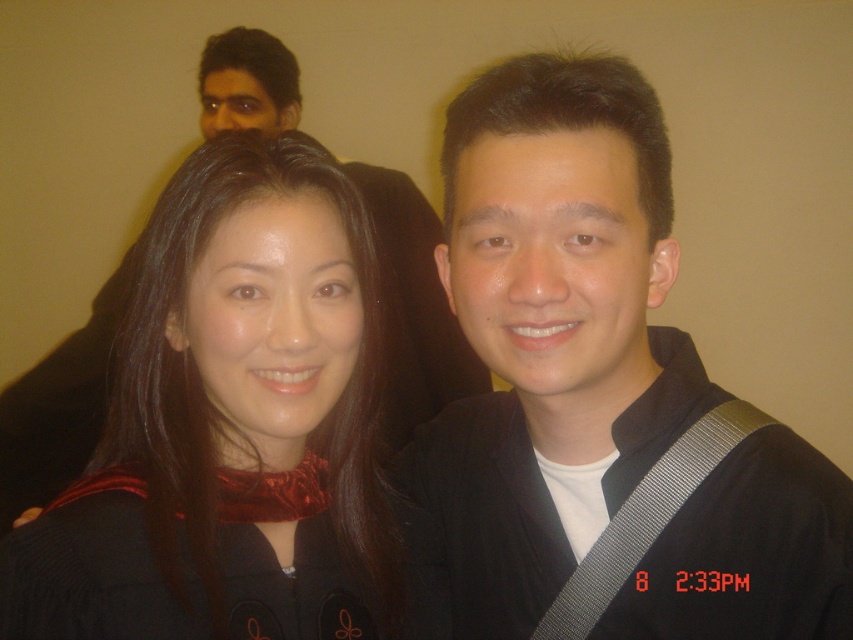
Is velvet black dress at center in front of black matte robe at center?

No.

Is point (334, 320) farther from viewer compared to point (723, 396)?

No.

You are a GUI agent. You are given a task and a screenshot of the screen. Output one action in this format:
    pyautogui.click(x=<x>, y=<y>)
    Task: Click on the velvet black dress at center
    The height and width of the screenshot is (640, 853).
    Given the screenshot: What is the action you would take?
    pyautogui.click(x=234, y=428)

What do you see at coordinates (747, 552) in the screenshot? I see `black matte robe at center` at bounding box center [747, 552].

In the scene shown: Between black matte robe at center and velvet-like black robe at lower left, which one has more height?

black matte robe at center is taller.

Which is behind, point (613, 470) or point (36, 563)?

Positioned behind is point (613, 470).

Where is `black matte robe at center`? black matte robe at center is located at coordinates (747, 552).

Which of these two, velvet black dress at center or velvet-like black robe at lower left, stands shorter?

With less height is velvet-like black robe at lower left.

You are a GUI agent. You are given a task and a screenshot of the screen. Output one action in this format:
    pyautogui.click(x=<x>, y=<y>)
    Task: Click on the velvet black dress at center
    The height and width of the screenshot is (640, 853).
    Given the screenshot: What is the action you would take?
    pyautogui.click(x=234, y=428)

This screenshot has width=853, height=640. Identify the location of velvet black dress at center. (234, 428).